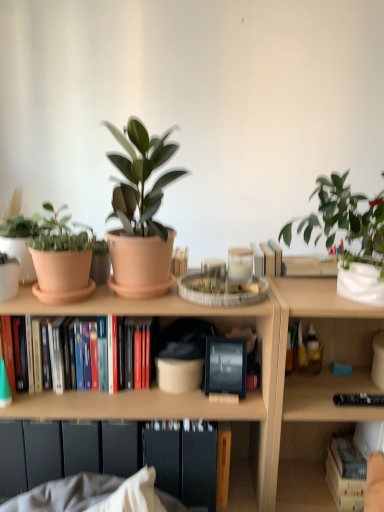
This screenshot has height=512, width=384. I want to click on blank space to the left of white matte vase at upper right, the 2th flowerpot from the left, so click(x=306, y=296).